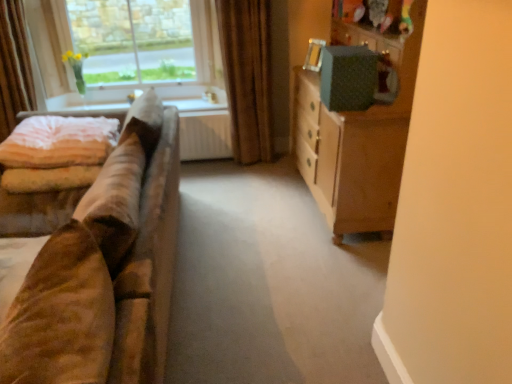
Find the location of `free spot in front of green textured cabinet at right`. free spot in front of green textured cabinet at right is located at coordinates (304, 276).